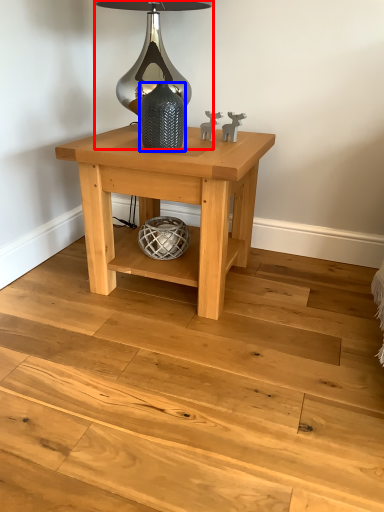
Question: Which object is closer to the camera taking this photo, table lamp (highlighted by a red box) or glass vase (highlighted by a blue box)?

Choices:
 (A) table lamp
 (B) glass vase

Answer: (B)